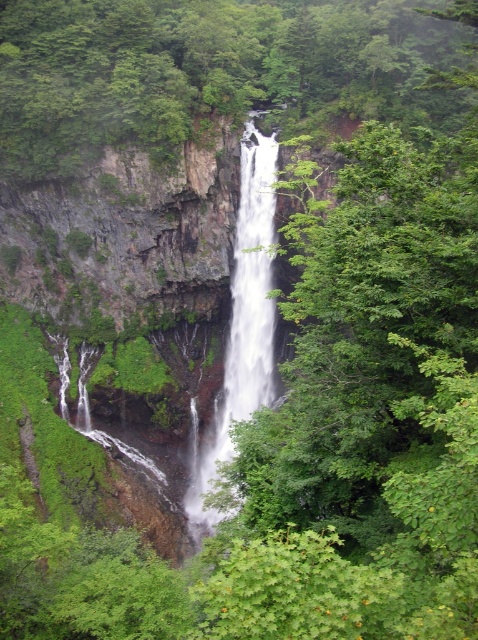
Question: Does green leafy tree at center lie in front of white smooth waterfall at center?

Choices:
 (A) no
 (B) yes

Answer: (A)

Question: Which point is closer to the camera taking this photo?

Choices:
 (A) (253, 410)
 (B) (272, 44)

Answer: (A)

Question: Where is green leafy tree at center located in relation to white smooth waterfall at center in the image?

Choices:
 (A) right
 (B) left

Answer: (A)

Question: From the image, what is the correct spatial relationship of green leafy tree at center in relation to white smooth waterfall at center?

Choices:
 (A) left
 (B) right

Answer: (B)